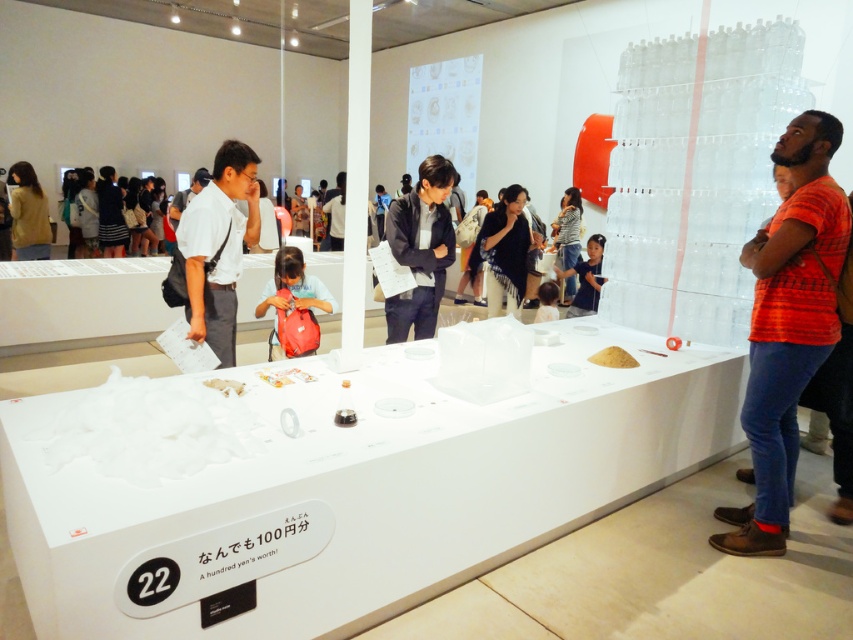
Question: Among these points, which one is nearest to the camera?

Choices:
 (A) (447, 164)
 (B) (581, 282)
 (C) (564, 216)
 (D) (521, 198)

Answer: (A)

Question: Which object is the closest to the dark gray jacket at center?

Choices:
 (A) black fringe scarf at center
 (B) white shirt at center
 (C) orange striped shirt at right

Answer: (B)

Question: Is white shirt at center positioned behind striped shirt at center?

Choices:
 (A) no
 (B) yes

Answer: (A)

Question: Which object is positioned farthest from the matte red backpack at center?

Choices:
 (A) striped shirt at center
 (B) dark gray jacket at center
 (C) black fringe scarf at center

Answer: (A)

Question: Does black fringe scarf at center come in front of matte pink dress at center?

Choices:
 (A) no
 (B) yes

Answer: (B)

Question: Does matte red backpack at center lie behind matte pink dress at center?

Choices:
 (A) yes
 (B) no

Answer: (B)